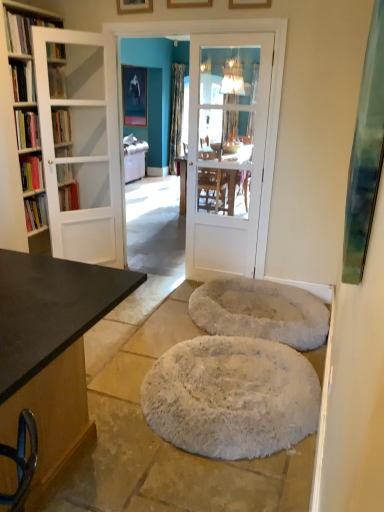
Image resolution: width=384 pixels, height=512 pixels. Describe the element at coordinates (249, 4) in the screenshot. I see `wooden picture frame at upper center, placed as the first picture frame when sorted from right to left` at that location.

What do you see at coordinates (51, 347) in the screenshot? I see `dark brown wood desk at left` at bounding box center [51, 347].

The image size is (384, 512). In order to click on wooden picture frame at upper center, which ranks as the second picture frame in right-to-left order in this screenshot , I will do `click(189, 3)`.

I want to click on fuzzy gray mat at center, which ranks as the 1th mat in back-to-front order, so pos(260,312).

Where is `wooden picture frame at upper center, which is counted as the first picture frame, starting from the bottom`? Image resolution: width=384 pixels, height=512 pixels. wooden picture frame at upper center, which is counted as the first picture frame, starting from the bottom is located at coordinates (249, 4).

From a real-world perspective, is white glass door at left, which is counted as the 1th door, starting from the left, below hardcover book at left, positioned as the fourth book in top-to-bottom order?

Yes.

Is point (112, 127) positioned behind point (21, 117)?

That is True.

Does white glass door at left, the 2th door from the right, have a lesser height compared to hardcover book at left, positioned as the fourth book in top-to-bottom order?

In fact, white glass door at left, the 2th door from the right, may be taller than hardcover book at left, positioned as the fourth book in top-to-bottom order.

Is white glass door at left, which is counted as the 1th door, starting from the left, not inside hardcover book at left, arranged as the 1th book when ordered from the bottom?

Indeed, white glass door at left, which is counted as the 1th door, starting from the left, is completely outside hardcover book at left, arranged as the 1th book when ordered from the bottom.

Is point (64, 88) closer or farther from the camera than point (244, 2)?

Point (64, 88).

Is matte white bookshelf at upper left, the second book viewed from the top, directly adjacent to wooden picture frame at upper center, the fourth picture frame positioned from the left?

No.

At what (x,y) coordinates should I click in order to perform the action: click on the 2nd picture frame positioned above the matte white bookshelf at upper left, the 3th book positioned from the bottom (from a real-world perspective). Please return your answer as a coordinate pair (x, y). Looking at the image, I should click on (249, 4).

Visually, is matte white bookshelf at upper left, the 3th book positioned from the bottom, positioned to the left or to the right of wooden picture frame at upper center, the fourth picture frame positioned from the left?

Based on their positions, matte white bookshelf at upper left, the 3th book positioned from the bottom, is located to the left of wooden picture frame at upper center, the fourth picture frame positioned from the left.

Is white glass door at left, the 2th door from the right, facing towards metallic silver picture frame at upper center, which is counted as the 4th picture frame, starting from the right?

No, white glass door at left, the 2th door from the right, is not aimed at metallic silver picture frame at upper center, which is counted as the 4th picture frame, starting from the right.

From the image's perspective, between white glass door at left, which is counted as the 1th door, starting from the left, and metallic silver picture frame at upper center, which is the first picture frame in top-to-bottom order, who is located below?

white glass door at left, which is counted as the 1th door, starting from the left, from the image's perspective.

How far apart are white glass door at left, which is counted as the 1th door, starting from the left, and metallic silver picture frame at upper center, the fourth picture frame ordered from the bottom?

white glass door at left, which is counted as the 1th door, starting from the left, and metallic silver picture frame at upper center, the fourth picture frame ordered from the bottom, are 3.74 meters apart.

Can you confirm if white fluffy mat at center, arranged as the 2th mat when viewed from the back, is thinner than matte white bookshelf at upper left, the second book viewed from the top?

In fact, white fluffy mat at center, arranged as the 2th mat when viewed from the back, might be wider than matte white bookshelf at upper left, the second book viewed from the top.

From a real-world perspective, does white fluffy mat at center, arranged as the 2th mat when viewed from the back, sit lower than matte white bookshelf at upper left, the 3th book positioned from the bottom?

Correct, in the physical world, white fluffy mat at center, arranged as the 2th mat when viewed from the back, is lower than matte white bookshelf at upper left, the 3th book positioned from the bottom.

Is matte white bookshelf at upper left, the second book viewed from the top, located within white fluffy mat at center, arranged as the 1th mat when viewed from the front?

Actually, matte white bookshelf at upper left, the second book viewed from the top, is outside white fluffy mat at center, arranged as the 1th mat when viewed from the front.

Between white fluffy mat at center, arranged as the 1th mat when viewed from the front, and matte white bookshelf at upper left, the 3th book positioned from the bottom, which one has smaller size?

With smaller size is matte white bookshelf at upper left, the 3th book positioned from the bottom.

Between wooden picture frame at upper center, the first picture frame when ordered from front to back, and wooden picture frame at upper center, which ranks as the 3th picture frame in back-to-front order, which one has less height?

With less height is wooden picture frame at upper center, which ranks as the 3th picture frame in back-to-front order.

Which is behind, point (232, 5) or point (205, 5)?

Point (205, 5)

Looking at this image, what's the angular difference between wooden picture frame at upper center, the 4th picture frame when ordered from back to front, and wooden picture frame at upper center, the second picture frame from the bottom,'s facing directions?

The angular difference between wooden picture frame at upper center, the 4th picture frame when ordered from back to front, and wooden picture frame at upper center, the second picture frame from the bottom, is 2.87 degrees.

From a real-world perspective, is wooden picture frame at upper center, which is counted as the first picture frame, starting from the bottom, on wooden picture frame at upper center, the second picture frame in the front-to-back sequence?

Yes.

Which of these two, wooden picture frame at upper center, the third picture frame from the bottom, or matte white bookshelf at upper left, the 3th book positioned from the bottom, is smaller?

With smaller size is wooden picture frame at upper center, the third picture frame from the bottom.

Considering the positions of objects wooden picture frame at upper center, which appears as the 2th picture frame when viewed from the left, and matte white bookshelf at upper left, the second book viewed from the top, in the image provided, who is in front, wooden picture frame at upper center, which appears as the 2th picture frame when viewed from the left, or matte white bookshelf at upper left, the second book viewed from the top,?

wooden picture frame at upper center, which appears as the 2th picture frame when viewed from the left, is closer to the camera.

In the scene shown: Does wooden picture frame at upper center, which is the 3th picture frame from right to left, appear on the left side of matte white bookshelf at upper left, the second book viewed from the top?

In fact, wooden picture frame at upper center, which is the 3th picture frame from right to left, is to the right of matte white bookshelf at upper left, the second book viewed from the top.

Would you say wooden picture frame at upper center, the 2th picture frame viewed from the back, is inside or outside matte white bookshelf at upper left, the 3th book positioned from the bottom?

wooden picture frame at upper center, the 2th picture frame viewed from the back, is outside matte white bookshelf at upper left, the 3th book positioned from the bottom.

Can you confirm if wooden picture frame at upper center, the 3th picture frame when ordered from front to back, is taller than wooden table at center?

In fact, wooden picture frame at upper center, the 3th picture frame when ordered from front to back, may be shorter than wooden table at center.

In terms of size, does wooden picture frame at upper center, which appears as the 2th picture frame when viewed from the left, appear bigger or smaller than wooden table at center?

Considering their sizes, wooden picture frame at upper center, which appears as the 2th picture frame when viewed from the left, takes up less space than wooden table at center.

Based on the photo, which is in front, wooden picture frame at upper center, the second picture frame viewed from the top, or wooden table at center?

wooden picture frame at upper center, the second picture frame viewed from the top.

Is wooden picture frame at upper center, which is the 3th picture frame from right to left, at the right side of wooden table at center?

Incorrect, wooden picture frame at upper center, which is the 3th picture frame from right to left, is not on the right side of wooden table at center.

Where is `the 1st door below the hardcover book at left, positioned as the fourth book in top-to-bottom order (from the image's perspective)`? This screenshot has height=512, width=384. the 1st door below the hardcover book at left, positioned as the fourth book in top-to-bottom order (from the image's perspective) is located at coordinates (82, 148).

Starting from the wooden picture frame at upper center, the 4th picture frame when ordered from back to front, which book is the 1st one to the left? Please provide its 2D coordinates.

[(57, 82)]

From the image, which object appears to be nearer to hardcover book at upper left, which is the first book from top to bottom, wooden table at center or wooden picture frame at upper center, which ranks as the 3th picture frame in back-to-front order?

wooden picture frame at upper center, which ranks as the 3th picture frame in back-to-front order, is closer to hardcover book at upper left, which is the first book from top to bottom.

Based on their spatial positions, is wooden table at center or wooden picture frame at upper center, the second picture frame viewed from the top, further from matte white bookshelf at upper left, the second book viewed from the top?

Based on the image, wooden table at center appears to be further to matte white bookshelf at upper left, the second book viewed from the top.

Looking at the image, which one is located closer to metallic silver picture frame at upper center, which is the first picture frame in top-to-bottom order, hardcover book at left, arranged as the 1th book when ordered from the bottom, or wooden picture frame at upper center, which is the 3th picture frame in top-to-bottom order?

Based on the image, wooden picture frame at upper center, which is the 3th picture frame in top-to-bottom order, appears to be nearer to metallic silver picture frame at upper center, which is the first picture frame in top-to-bottom order.

Considering their positions, is wooden picture frame at upper center, the fourth picture frame positioned from the left, positioned closer to hardcover book at upper left, arranged as the fourth book when ordered from the bottom, than fuzzy gray mat at center, which ranks as the 1th mat in back-to-front order?

wooden picture frame at upper center, the fourth picture frame positioned from the left, is closer to hardcover book at upper left, arranged as the fourth book when ordered from the bottom.

From the picture: Based on their spatial positions, is hardcover book at upper left, which is the first book from top to bottom, or hardcover book at left, the 3th book viewed from the top, closer to wooden table at center?

hardcover book at left, the 3th book viewed from the top, lies closer to wooden table at center than the other object.

Considering their positions, is hardcover book at left, the 3th book viewed from the top, positioned closer to white glass door at left, the 2th door from the right, than white glossy door at center, which ranks as the first door in right-to-left order?

Based on the image, hardcover book at left, the 3th book viewed from the top, appears to be nearer to white glass door at left, the 2th door from the right.

Considering their positions, is dark brown wood desk at left positioned closer to white glass door at left, the 2th door from the right, than wooden picture frame at upper center, which is counted as the first picture frame, starting from the bottom?

wooden picture frame at upper center, which is counted as the first picture frame, starting from the bottom, is closer to white glass door at left, the 2th door from the right.

When comparing their distances from matte white bookshelf at upper left, the second book viewed from the top, does dark brown wood desk at left or metallic silver picture frame at upper center, positioned as the fourth picture frame in front-to-back order, seem closer?

dark brown wood desk at left lies closer to matte white bookshelf at upper left, the second book viewed from the top, than the other object.

This screenshot has width=384, height=512. In order to click on door located between white glossy door at center, which ranks as the first door in right-to-left order, and metallic silver picture frame at upper center, positioned as the fourth picture frame in front-to-back order, in the depth direction in this screenshot , I will do `click(82, 148)`.

Image resolution: width=384 pixels, height=512 pixels. I want to click on picture frame between wooden picture frame at upper center, which is the 3th picture frame from right to left, and wooden picture frame at upper center, the 4th picture frame viewed from the top, so click(x=189, y=3).

The image size is (384, 512). Find the location of `door between hardcover book at left, positioned as the fourth book in top-to-bottom order, and wooden picture frame at upper center, which is the 3th picture frame in top-to-bottom order, from left to right`. door between hardcover book at left, positioned as the fourth book in top-to-bottom order, and wooden picture frame at upper center, which is the 3th picture frame in top-to-bottom order, from left to right is located at coordinates (82, 148).

This screenshot has height=512, width=384. I want to click on door between hardcover book at left, the 3th book viewed from the top, and white glossy door at center, the 2th door positioned from the left, so click(82, 148).